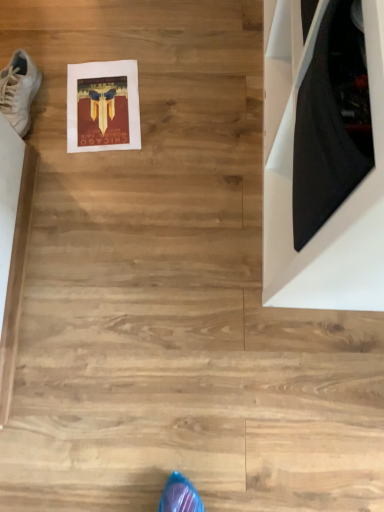
Measure the distance between black matte cardboard at right and camera.

40.00 centimeters.

The height and width of the screenshot is (512, 384). Describe the element at coordinates (341, 204) in the screenshot. I see `black matte cardboard at right` at that location.

You are a GUI agent. You are given a task and a screenshot of the screen. Output one action in this format:
    pyautogui.click(x=<x>, y=<y>)
    Task: Click on the black matte cardboard at right
    
    Given the screenshot: What is the action you would take?
    pyautogui.click(x=341, y=204)

The height and width of the screenshot is (512, 384). Identify the location of black matte cardboard at right. (341, 204).